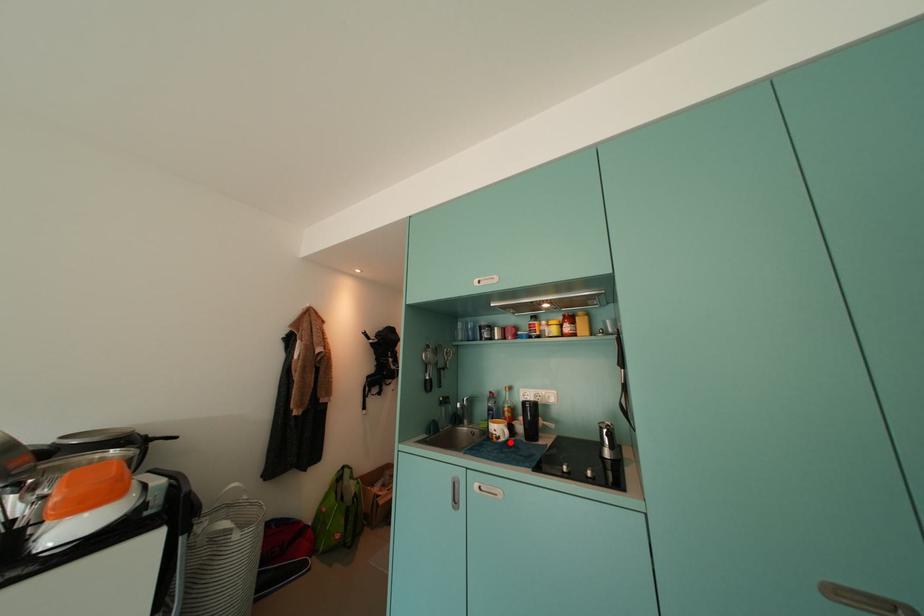
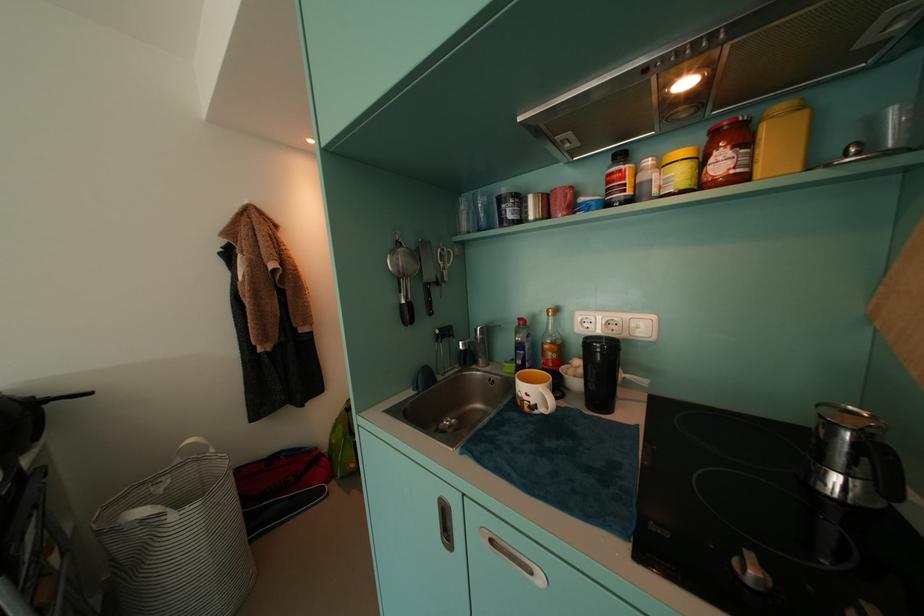
Find the pixel in the second image that matches the highlighted location in the first image.

(550, 413)